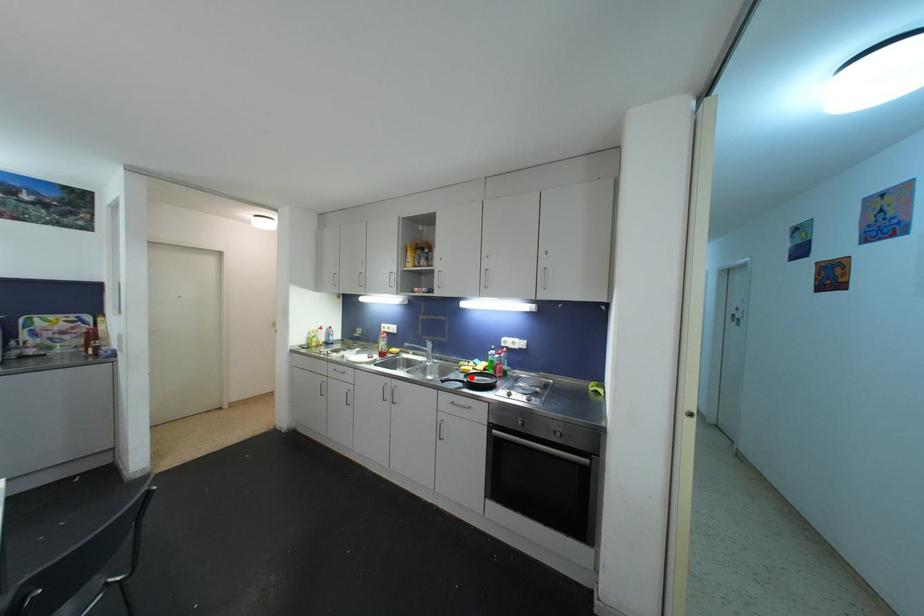
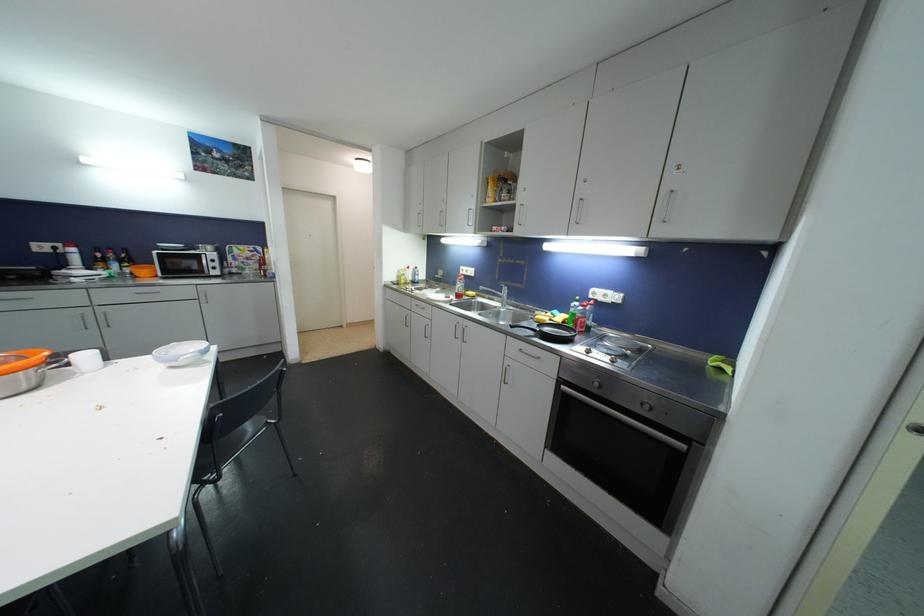
Question: I am providing you with two images of the same scene from different viewpoints. A red point is marked on the first image. Is the red point's position out of view in image 2?

Choices:
 (A) Yes
 (B) No

Answer: (B)